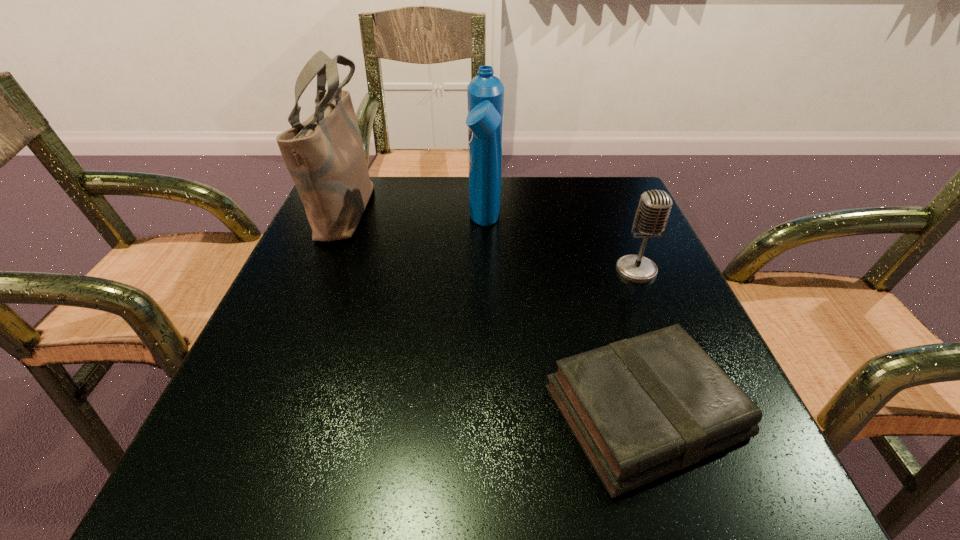
Find the location of a particular element. The width and height of the screenshot is (960, 540). shoulder bag positioned at the far edge is located at coordinates (325, 156).

Find the location of a particular element. The width and height of the screenshot is (960, 540). shampoo situated at the far edge is located at coordinates (485, 93).

You are a GUI agent. You are given a task and a screenshot of the screen. Output one action in this format:
    pyautogui.click(x=<x>, y=<y>)
    Task: Click on the object located in the near edge section of the desktop
    The image size is (960, 540).
    Given the screenshot: What is the action you would take?
    pyautogui.click(x=640, y=408)

Locate an element on the screen. The height and width of the screenshot is (540, 960). object at the left edge is located at coordinates (325, 156).

What are the coordinates of `microphone at the right edge` in the screenshot? It's located at (654, 208).

At what (x,y) coordinates should I click in order to perform the action: click on book positioned at the right edge. Please return your answer as a coordinate pair (x, y). The image size is (960, 540). Looking at the image, I should click on 640,408.

Identify the location of object positioned at the far left corner. This screenshot has width=960, height=540. (325, 156).

This screenshot has height=540, width=960. Identify the location of object that is at the near right corner. (640, 408).

Image resolution: width=960 pixels, height=540 pixels. Identify the location of vacant space at the far edge of the desktop. (565, 221).

Locate an element on the screen. vacant area at the near edge of the desktop is located at coordinates (641, 500).